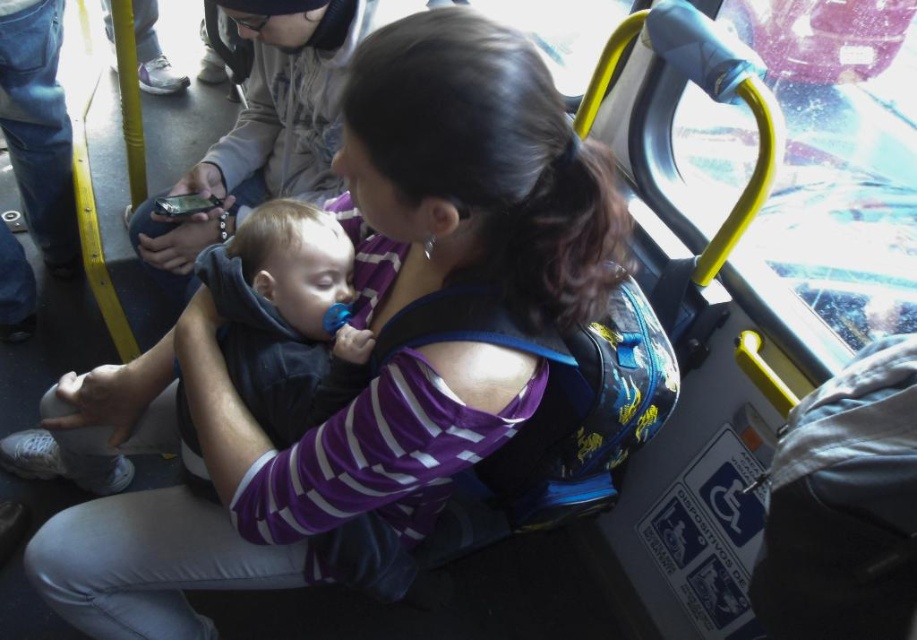
What are the coordinates of the purple striped shirt at center in the image?

The purple striped shirt at center is located at coordinates point (372, 352).

In the scene shown: You are a designer trying to create a layout for a magazine cover. You have two elements to place on the cover. The first is an image of the purple striped shirt at center, and the second is an image of the matte black phone at upper left. Based on the scene, which element should you make wider in your design?

The purple striped shirt at center is wider than the matte black phone at upper left, so you should make the image of the purple striped shirt at center wider in your design.

You are a passenger on a bus and need to place both the dark blue fleece at center and the matte black phone at upper left into a narrow bag compartment that can only hold items up to the thickness of the thinner object. Which item should you place first to ensure both fit?

The dark blue fleece at center is thinner than the matte black phone at upper left, so you should place the matte black phone at upper left first, then the dark blue fleece at center to ensure both fit within the compartment.